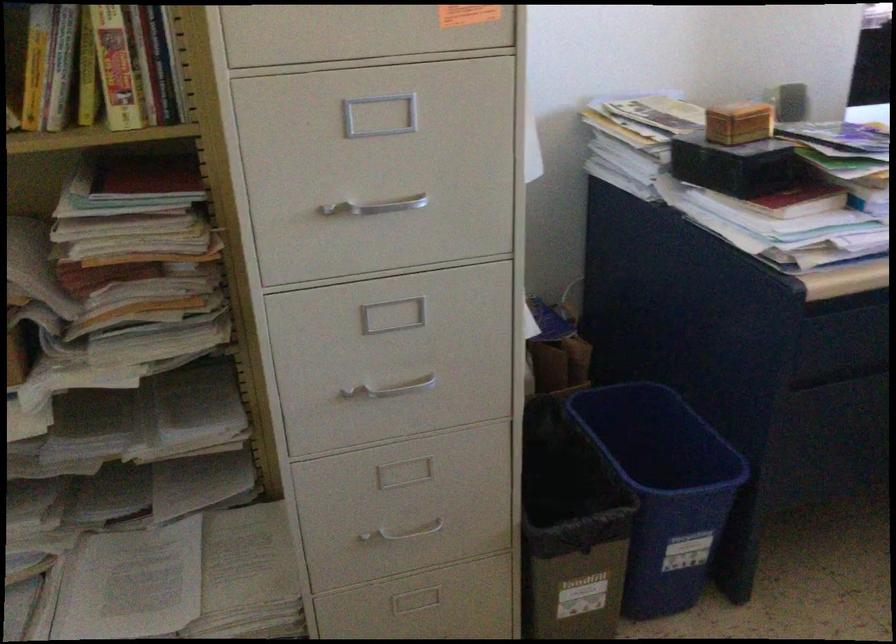
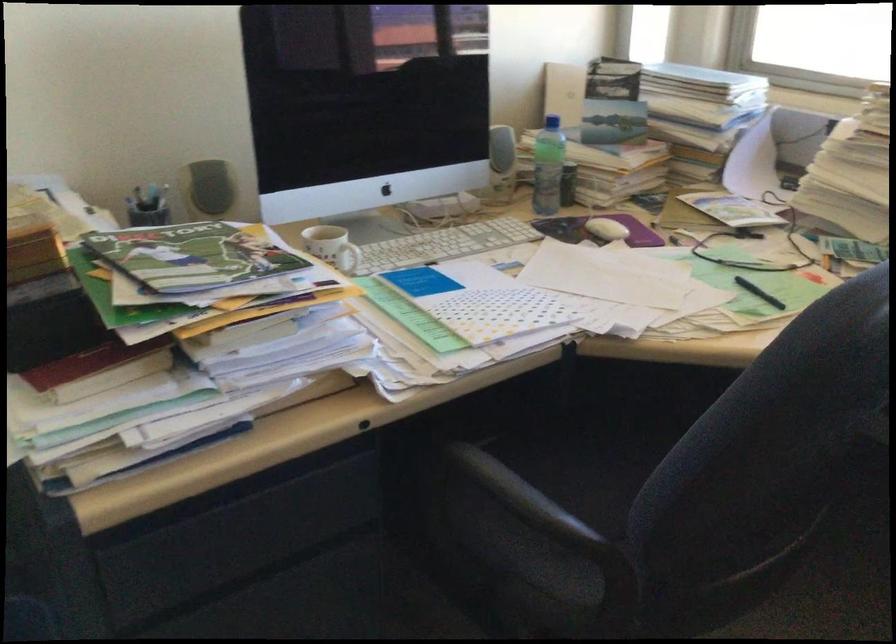
Question: How did the camera likely rotate?

Choices:
 (A) Left
 (B) Right
 (C) Up
 (D) Down

Answer: (B)